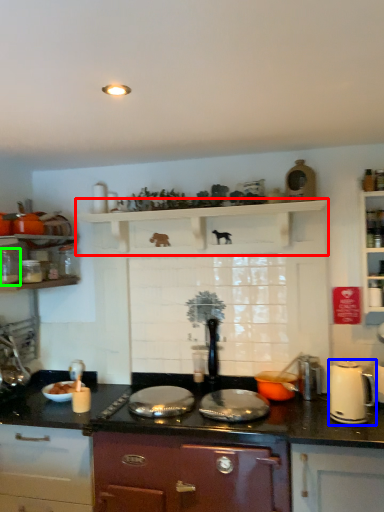
Question: Based on their relative distances, which object is farther from shelf (highlighted by a red box)? Choose from kitchen appliance (highlighted by a blue box) and kitchen appliance (highlighted by a green box).

Choices:
 (A) kitchen appliance
 (B) kitchen appliance

Answer: (A)